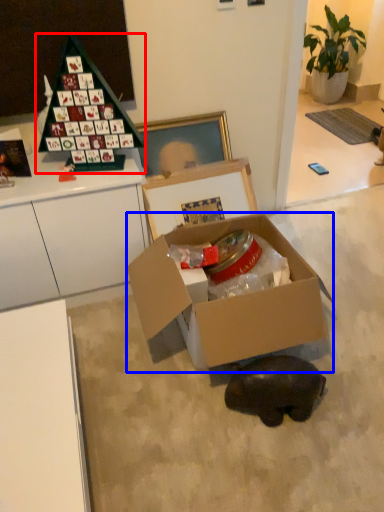
Question: Which object is further to the camera taking this photo, toy (highlighted by a red box) or box (highlighted by a blue box)?

Choices:
 (A) toy
 (B) box

Answer: (A)